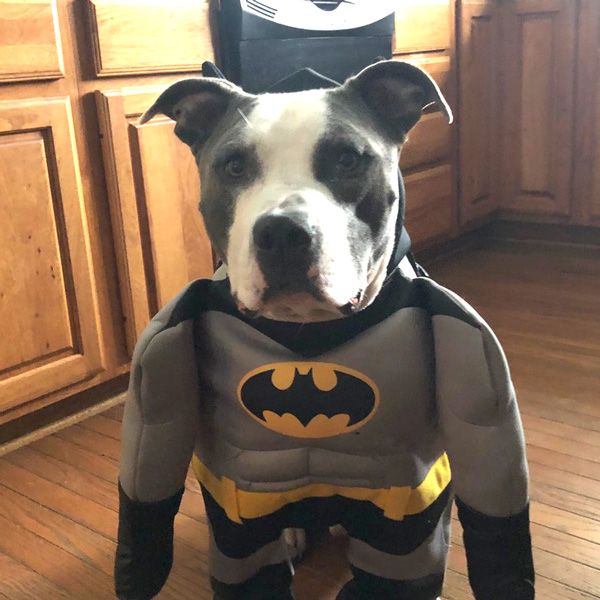
Locate an element on the screen. This screenshot has height=600, width=600. floor is located at coordinates (80, 544).